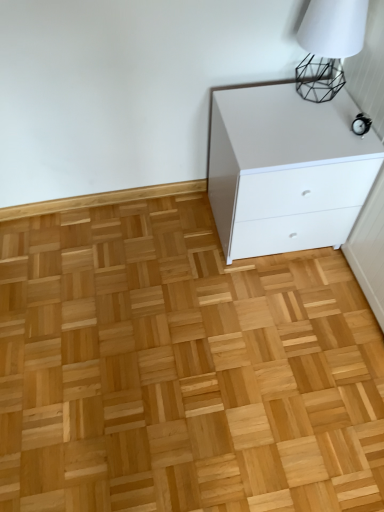
Question: Does point click(x=304, y=138) appear closer or farther from the camera than point click(x=324, y=46)?

Choices:
 (A) closer
 (B) farther

Answer: (B)

Question: From the image's perspective, is white glossy chest of drawers at upper right above or below white matte table lamp at upper right?

Choices:
 (A) above
 (B) below

Answer: (B)

Question: Which is farther from the white matte table lamp at upper right?

Choices:
 (A) white glossy chest of drawers at upper right
 (B) natural wood floor at center

Answer: (B)

Question: Estimate the real-world distances between objects in this image. Which object is farther from the white matte table lamp at upper right?

Choices:
 (A) natural wood floor at center
 (B) white glossy chest of drawers at upper right

Answer: (A)